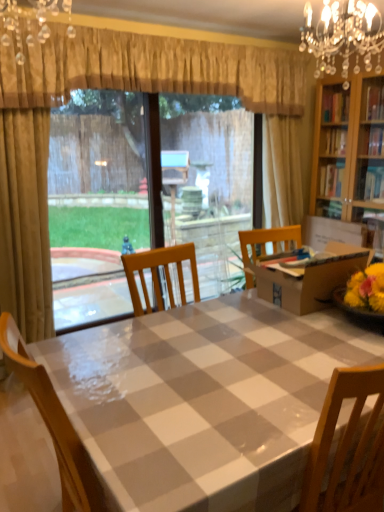
Question: From the image's perspective, is crystal glass chandelier at upper center, placed as the 1th light fixture when sorted from front to back, below checkered plastic table at center?

Choices:
 (A) no
 (B) yes

Answer: (A)

Question: Does crystal glass chandelier at upper center, placed as the 1th light fixture when sorted from front to back, come in front of checkered plastic table at center?

Choices:
 (A) no
 (B) yes

Answer: (A)

Question: Does crystal glass chandelier at upper center, placed as the 1th light fixture when sorted from front to back, have a greater width compared to checkered plastic table at center?

Choices:
 (A) no
 (B) yes

Answer: (A)

Question: Does crystal glass chandelier at upper center, placed as the 2th light fixture when sorted from right to left, have a lesser width compared to checkered plastic table at center?

Choices:
 (A) yes
 (B) no

Answer: (A)

Question: Considering the relative sizes of crystal glass chandelier at upper center, which is the second light fixture in back-to-front order, and checkered plastic table at center in the image provided, is crystal glass chandelier at upper center, which is the second light fixture in back-to-front order, taller than checkered plastic table at center?

Choices:
 (A) yes
 (B) no

Answer: (B)

Question: In the image, is crystal glass chandelier at upper center, placed as the 1th light fixture when sorted from left to right, on the left side or the right side of gold textured curtain at upper center?

Choices:
 (A) right
 (B) left

Answer: (B)

Question: In terms of width, does crystal glass chandelier at upper center, which is the second light fixture in back-to-front order, look wider or thinner when compared to gold textured curtain at upper center?

Choices:
 (A) thin
 (B) wide

Answer: (B)

Question: From a real-world perspective, is crystal glass chandelier at upper center, placed as the 1th light fixture when sorted from front to back, physically located above or below gold textured curtain at upper center?

Choices:
 (A) above
 (B) below

Answer: (B)

Question: Would you say crystal glass chandelier at upper center, placed as the 1th light fixture when sorted from left to right, is inside or outside gold textured curtain at upper center?

Choices:
 (A) outside
 (B) inside

Answer: (A)

Question: Considering their positions, is crystal glass chandelier at upper center, placed as the 1th light fixture when sorted from left to right, located in front of or behind checkered plastic table at center?

Choices:
 (A) behind
 (B) front

Answer: (A)

Question: Is crystal glass chandelier at upper center, placed as the 2th light fixture when sorted from right to left, inside the boundaries of checkered plastic table at center, or outside?

Choices:
 (A) inside
 (B) outside

Answer: (B)

Question: From a real-world perspective, relative to checkered plastic table at center, is crystal glass chandelier at upper center, which is the second light fixture in back-to-front order, vertically above or below?

Choices:
 (A) above
 (B) below

Answer: (A)

Question: Considering the positions of crystal glass chandelier at upper center, placed as the 2th light fixture when sorted from right to left, and checkered plastic table at center in the image, is crystal glass chandelier at upper center, placed as the 2th light fixture when sorted from right to left, bigger or smaller than checkered plastic table at center?

Choices:
 (A) small
 (B) big

Answer: (A)

Question: Considering the relative positions of clear plastic window screen at center and crystal chandelier at upper right, which is the 2th light fixture from left to right, in the image provided, is clear plastic window screen at center to the left or to the right of crystal chandelier at upper right, which is the 2th light fixture from left to right,?

Choices:
 (A) right
 (B) left

Answer: (B)

Question: Considering the positions of clear plastic window screen at center and crystal chandelier at upper right, which is the 1th light fixture in back-to-front order, in the image, is clear plastic window screen at center taller or shorter than crystal chandelier at upper right, which is the 1th light fixture in back-to-front order,?

Choices:
 (A) short
 (B) tall

Answer: (B)